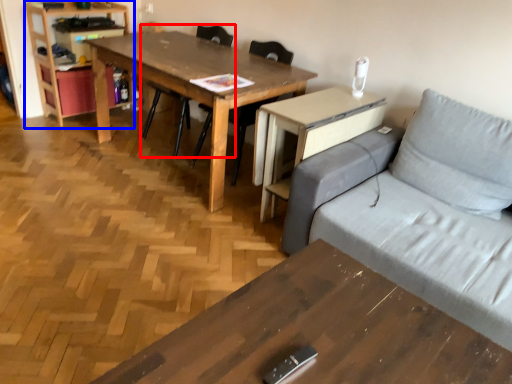
Question: Which object appears farthest to the camera in this image, chair (highlighted by a red box) or bookshelf (highlighted by a blue box)?

Choices:
 (A) chair
 (B) bookshelf

Answer: (B)